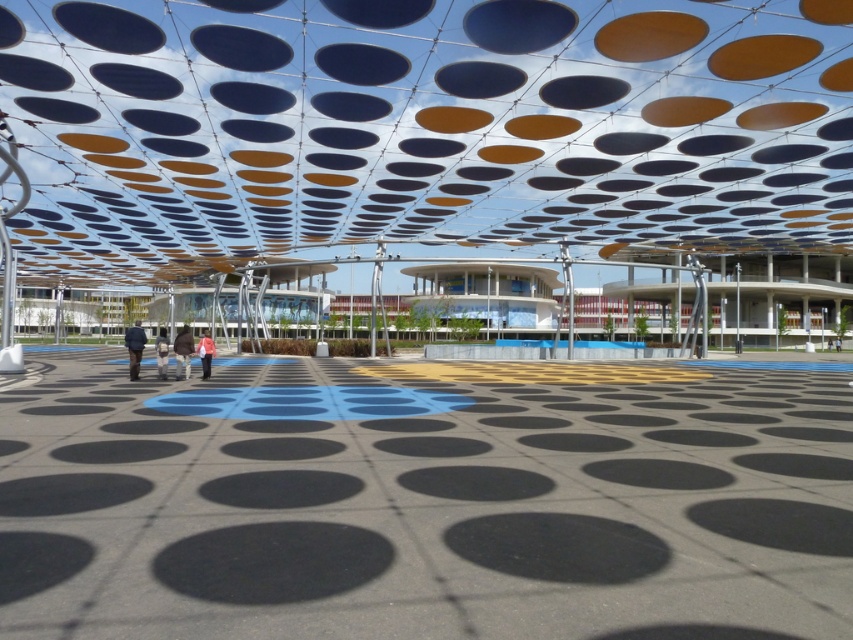
Question: Estimate the real-world distances between objects in this image. Which object is farther from the dark brown leather jacket at center?

Choices:
 (A) orange fabric jacket at lower center
 (B) light brown leather jacket at center
 (C) blue fabric jacket at center

Answer: (C)

Question: Which object is farther from the camera taking this photo?

Choices:
 (A) dark brown leather jacket at center
 (B) light brown leather jacket at center
 (C) blue fabric jacket at center
 (D) orange fabric jacket at lower center

Answer: (D)

Question: Among these objects, which one is nearest to the camera?

Choices:
 (A) orange fabric jacket at lower center
 (B) blue fabric jacket at center
 (C) dark brown leather jacket at center
 (D) light brown leather jacket at center

Answer: (B)

Question: Does dark brown leather jacket at center appear on the right side of light brown leather jacket at center?

Choices:
 (A) no
 (B) yes

Answer: (B)

Question: Can you confirm if blue fabric jacket at center is positioned to the left of light brown leather jacket at center?

Choices:
 (A) yes
 (B) no

Answer: (A)

Question: Can you confirm if dark brown leather jacket at center is positioned below blue fabric jacket at center?

Choices:
 (A) no
 (B) yes

Answer: (B)